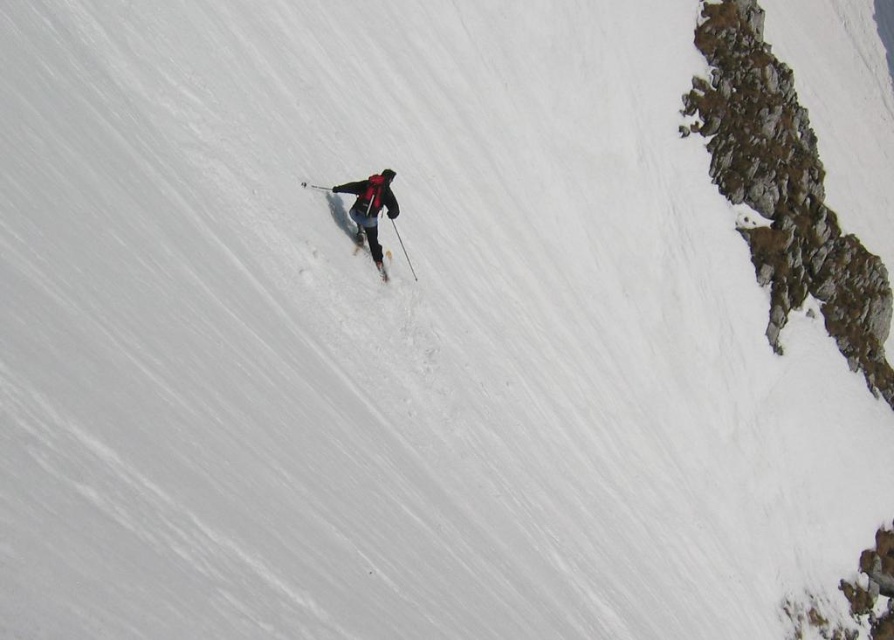
Who is more forward, [356,220] or [384,272]?

Point [356,220] is more forward.

Is point (380, 188) behind point (384, 266)?

No, it is in front of (384, 266).

Which is in front, point (382, 202) or point (360, 243)?

Positioned in front is point (382, 202).

Locate an element on the screen. The height and width of the screenshot is (640, 894). matte black ski suit at center is located at coordinates (370, 209).